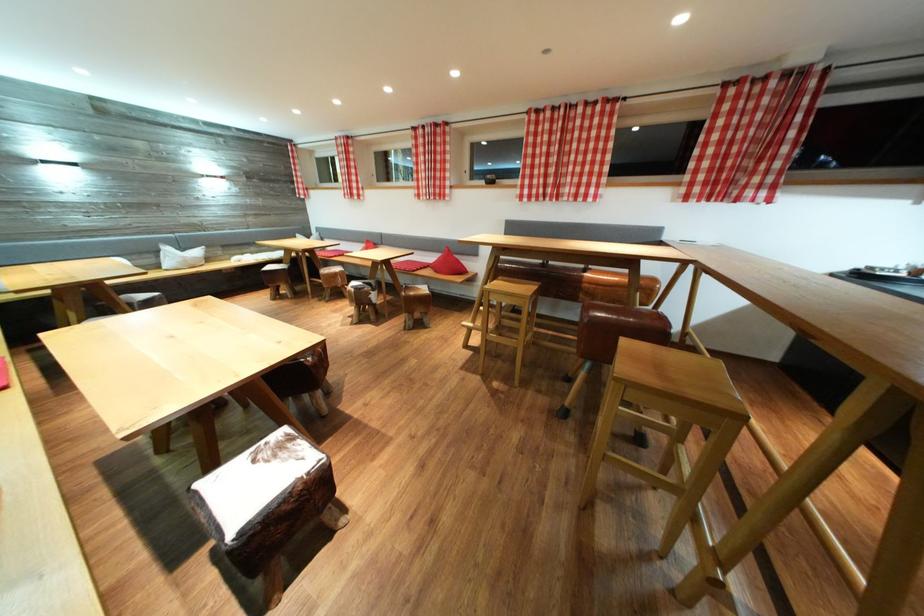
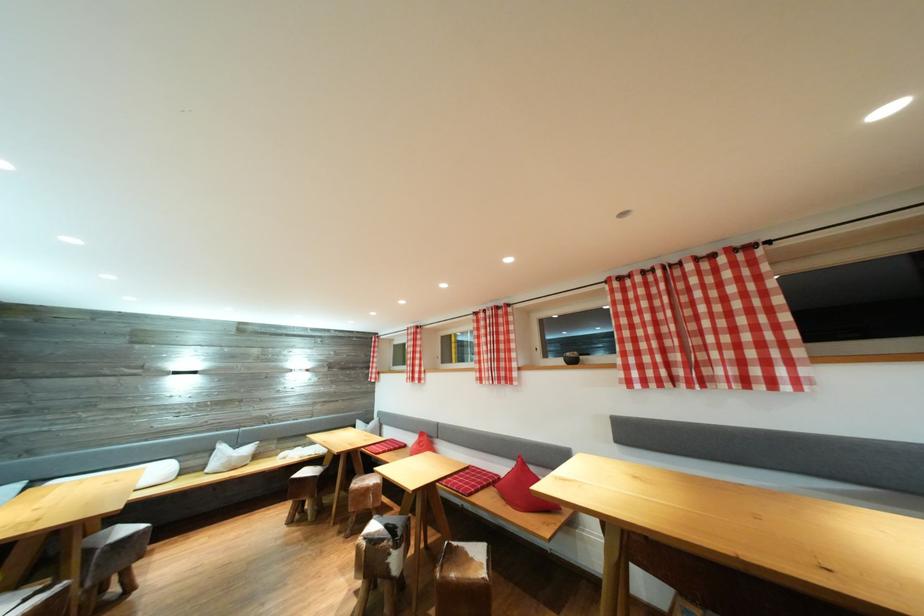
Where in the second image is the point corresponding to [355,164] from the first image?

(421, 351)